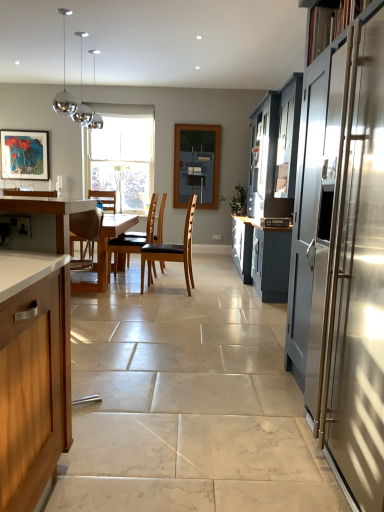
Question: Can you confirm if satin silver microwave at center is wider than brown leather chair at center, which is counted as the 1th chair, starting from the back?

Choices:
 (A) yes
 (B) no

Answer: (B)

Question: Is satin silver microwave at center far away from brown leather chair at center, which is the 1th chair from left to right?

Choices:
 (A) no
 (B) yes

Answer: (B)

Question: Can you confirm if satin silver microwave at center is shorter than brown leather chair at center, the 2th chair positioned from the right?

Choices:
 (A) no
 (B) yes

Answer: (B)

Question: Is satin silver microwave at center turned away from brown leather chair at center, arranged as the 2th chair when viewed from the front?

Choices:
 (A) no
 (B) yes

Answer: (A)

Question: Is satin silver microwave at center with brown leather chair at center, which is counted as the 1th chair, starting from the back?

Choices:
 (A) no
 (B) yes

Answer: (A)

Question: Considering the positions of matte wooden picture frame at upper left and brown leather chair at center, arranged as the 2th chair when viewed from the front, in the image, is matte wooden picture frame at upper left wider or thinner than brown leather chair at center, arranged as the 2th chair when viewed from the front,?

Choices:
 (A) wide
 (B) thin

Answer: (B)

Question: In terms of height, does matte wooden picture frame at upper left look taller or shorter compared to brown leather chair at center, which is counted as the 1th chair, starting from the back?

Choices:
 (A) short
 (B) tall

Answer: (A)

Question: In the image, is matte wooden picture frame at upper left positioned in front of or behind brown leather chair at center, which is counted as the 1th chair, starting from the back?

Choices:
 (A) front
 (B) behind

Answer: (B)

Question: Considering the positions of point (8, 157) and point (152, 203), is point (8, 157) closer or farther from the camera than point (152, 203)?

Choices:
 (A) closer
 (B) farther

Answer: (B)

Question: In terms of height, does wooden countertop at left, which is counted as the 1th cabinetry, starting from the left, look taller or shorter compared to satin silver microwave at center?

Choices:
 (A) tall
 (B) short

Answer: (A)

Question: Is wooden countertop at left, positioned as the 3th cabinetry in right-to-left order, to the left or to the right of satin silver microwave at center in the image?

Choices:
 (A) left
 (B) right

Answer: (A)

Question: Is wooden countertop at left, positioned as the 3th cabinetry in right-to-left order, in front of or behind satin silver microwave at center in the image?

Choices:
 (A) front
 (B) behind

Answer: (A)

Question: Is point (3, 309) positioned closer to the camera than point (283, 223)?

Choices:
 (A) farther
 (B) closer

Answer: (B)

Question: Is matte glass window screen at center in front of or behind brown leather chair at center, which is counted as the 2th chair, starting from the back, in the image?

Choices:
 (A) front
 (B) behind

Answer: (B)

Question: Considering the positions of matte glass window screen at center and brown leather chair at center, positioned as the 2th chair in left-to-right order, in the image, is matte glass window screen at center wider or thinner than brown leather chair at center, positioned as the 2th chair in left-to-right order,?

Choices:
 (A) thin
 (B) wide

Answer: (A)